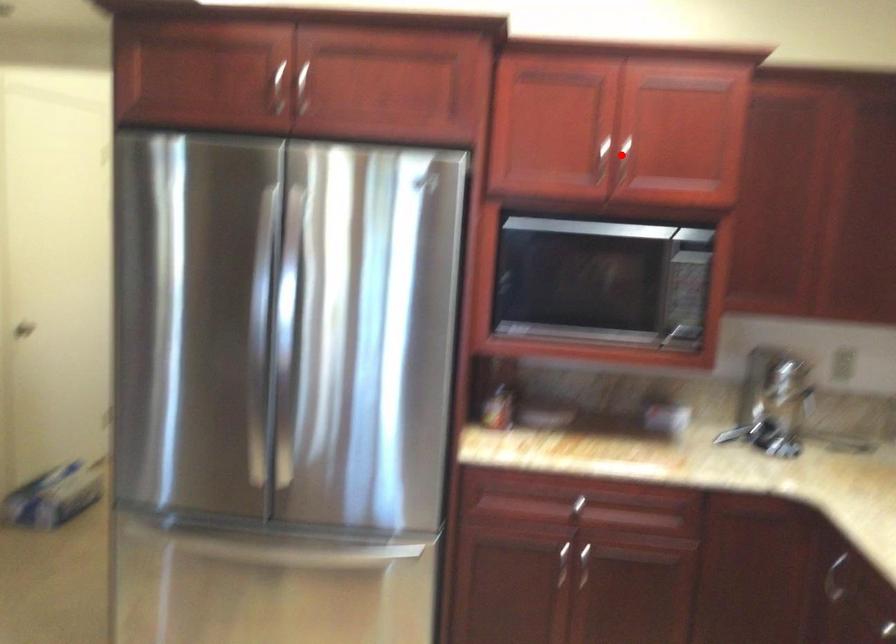
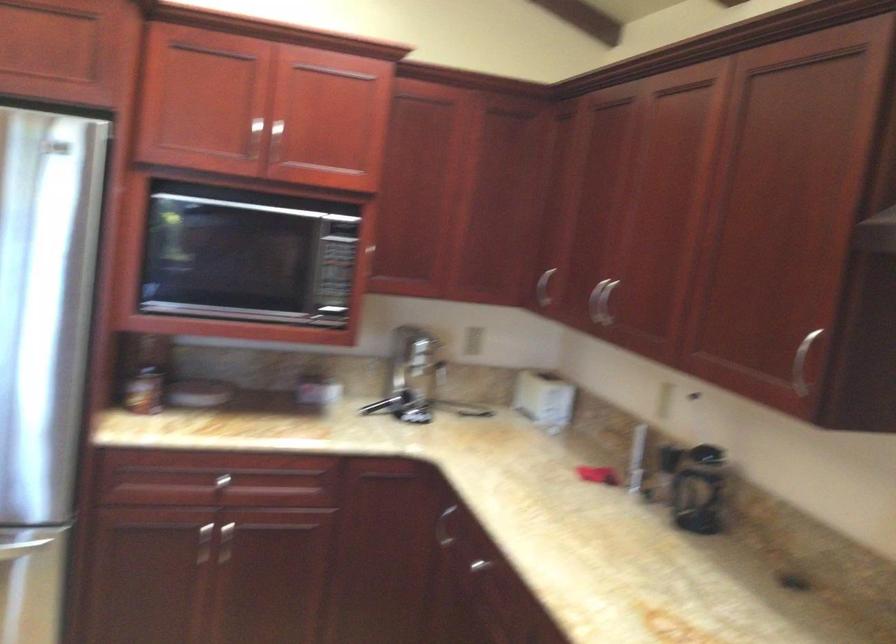
In the second image, find the point that corresponds to the highlighted location in the first image.

(274, 140)